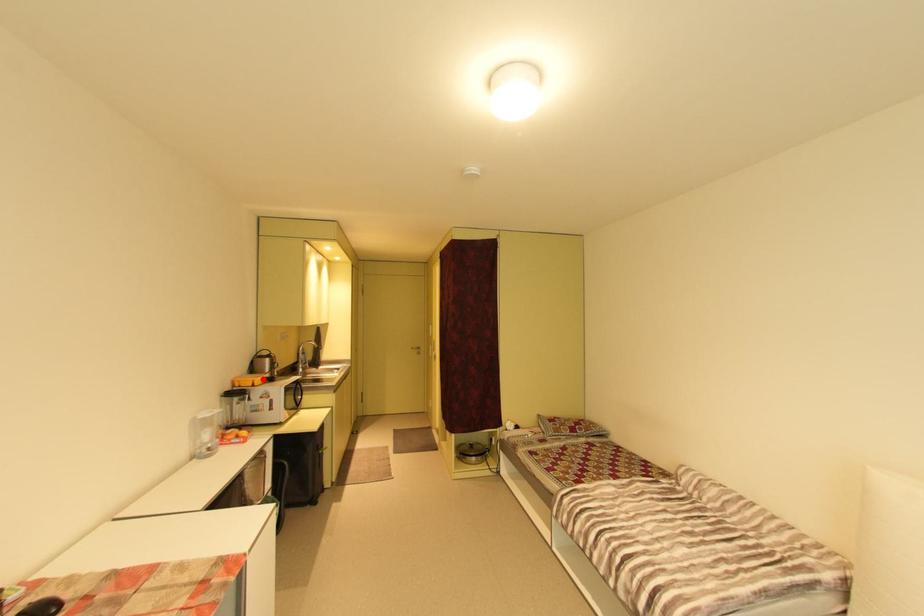
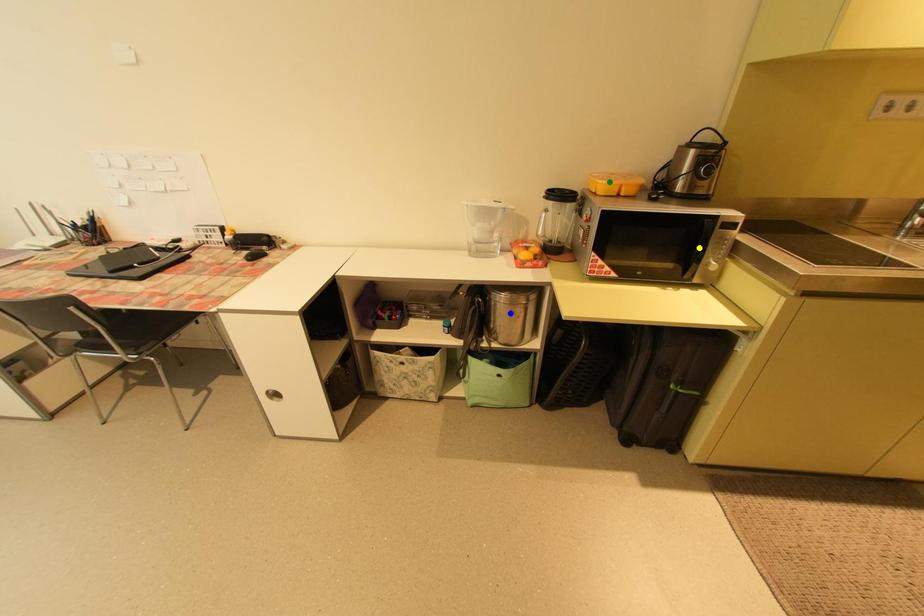
Question: I am providing you with two images of the same scene from different viewpoints. A red point is marked on the first image. You are given multiple points on the second image. Which point in image 2 is actually the same real-world point as the red point in image 1?

Choices:
 (A) blue point
 (B) green point
 (C) yellow point

Answer: (B)